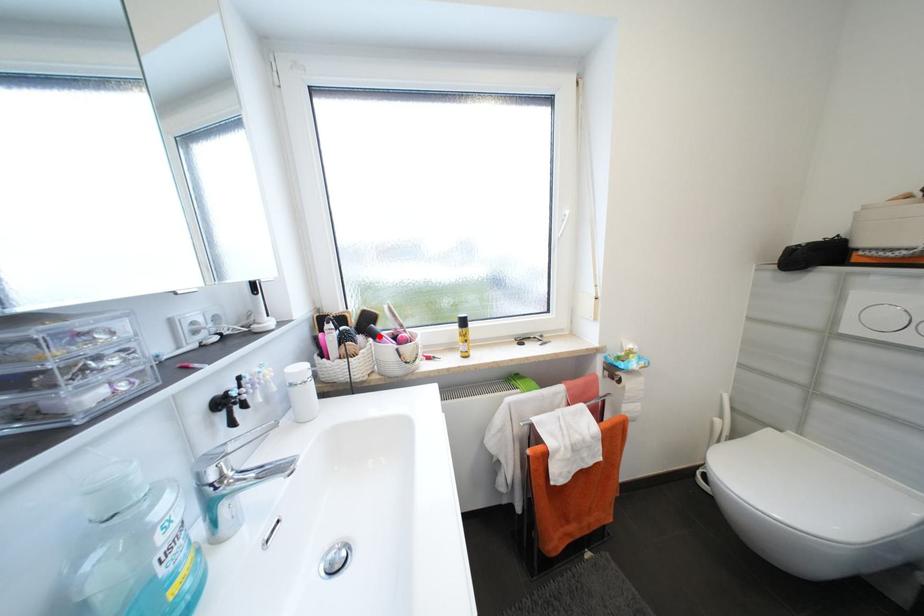
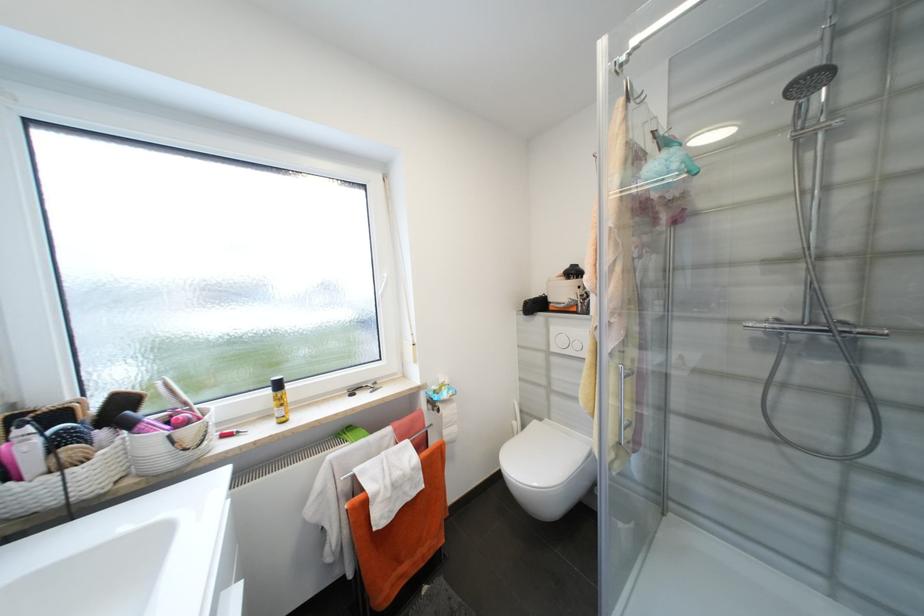
Locate, in the second image, the point that corresponds to the highlighted location in the first image.

(134, 427)